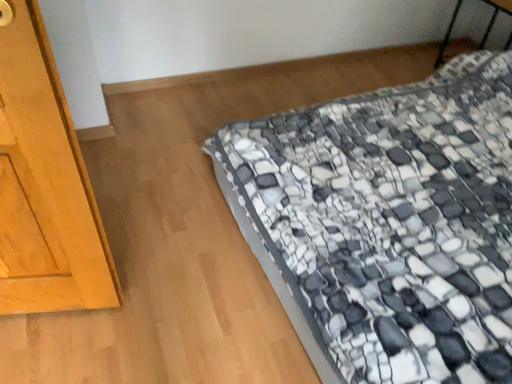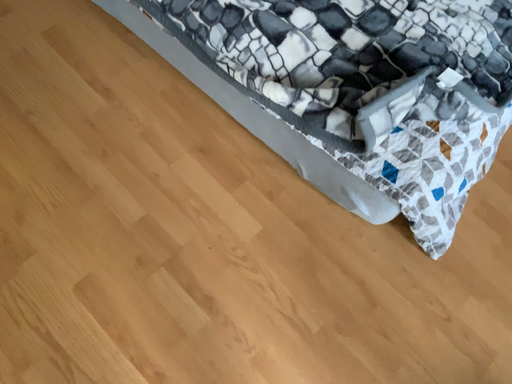
Question: How did the camera likely rotate when shooting the video?

Choices:
 (A) rotated upward
 (B) rotated downward

Answer: (B)